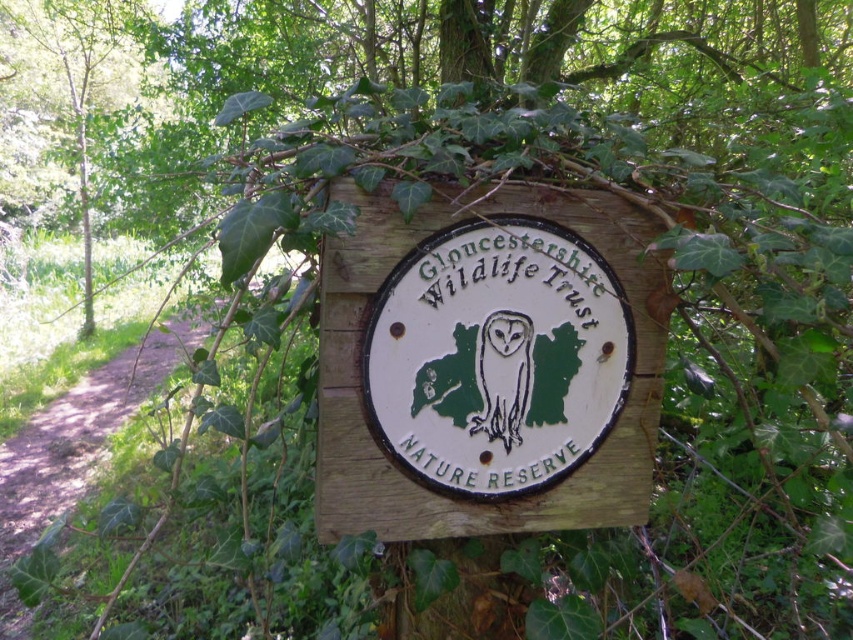
Question: Is wooden sign at center to the right of white paper owl at center from the viewer's perspective?

Choices:
 (A) yes
 (B) no

Answer: (B)

Question: Which point is farther from the camera taking this photo?

Choices:
 (A) (526, 353)
 (B) (641, 236)
 (C) (44, 513)

Answer: (C)

Question: Considering the real-world distances, which object is farthest from the dirt path at left?

Choices:
 (A) white paper owl at center
 (B) wooden sign at center

Answer: (A)

Question: Does dirt path at left appear over white paper owl at center?

Choices:
 (A) no
 (B) yes

Answer: (A)

Question: Which object appears closest to the camera in this image?

Choices:
 (A) dirt path at left
 (B) wooden sign at center
 (C) white paper owl at center

Answer: (B)

Question: Can you confirm if dirt path at left is positioned below white paper owl at center?

Choices:
 (A) no
 (B) yes

Answer: (B)